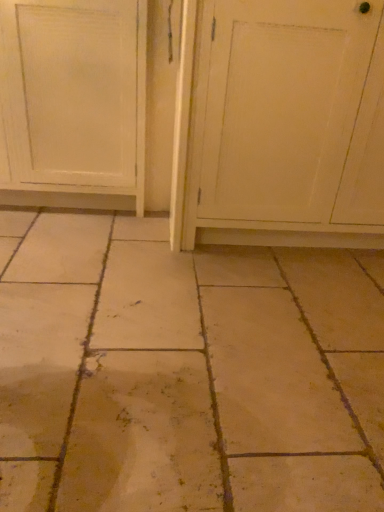
Question: Is white wood screen door at center in front of or behind white painted wood door at left in the image?

Choices:
 (A) front
 (B) behind

Answer: (A)

Question: From their relative heights in the image, would you say white wood screen door at center is taller or shorter than white painted wood door at left?

Choices:
 (A) short
 (B) tall

Answer: (B)

Question: Is point (380, 222) closer or farther from the camera than point (67, 136)?

Choices:
 (A) farther
 (B) closer

Answer: (B)

Question: From a real-world perspective, is white painted wood door at left positioned above or below white wood screen door at center?

Choices:
 (A) below
 (B) above

Answer: (A)

Question: From their relative heights in the image, would you say white painted wood door at left is taller or shorter than white wood screen door at center?

Choices:
 (A) short
 (B) tall

Answer: (A)

Question: Would you say white painted wood door at left is to the left or to the right of white wood screen door at center in the picture?

Choices:
 (A) right
 (B) left

Answer: (B)

Question: Relative to white wood screen door at center, is white painted wood door at left in front or behind?

Choices:
 (A) behind
 (B) front

Answer: (A)